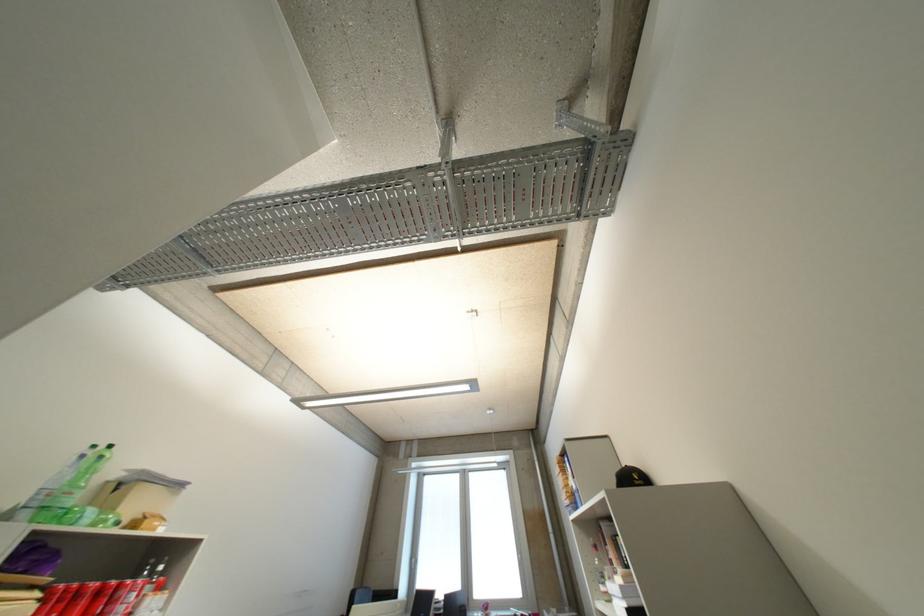
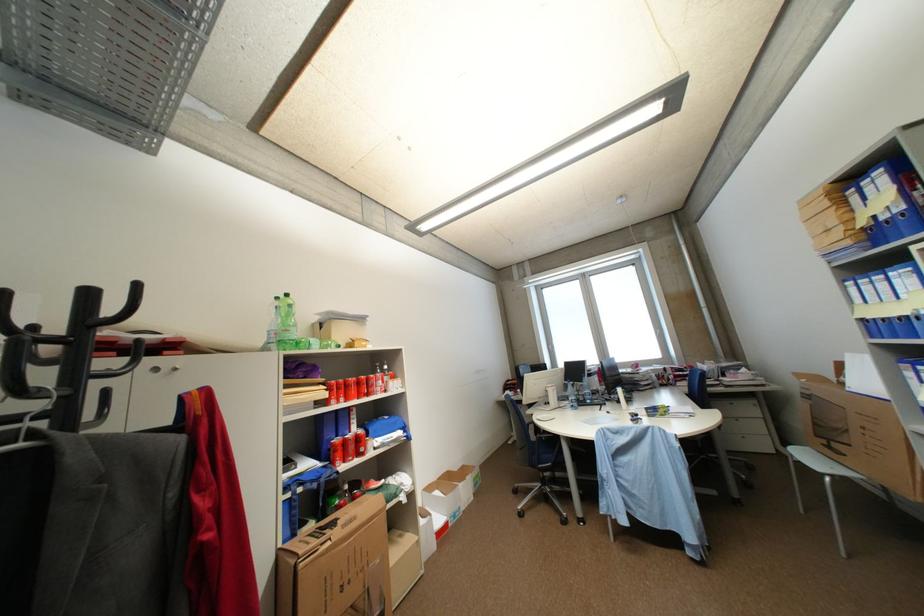
Find the pixel in the second image that matches pixel 103 448 in the first image.

(286, 300)